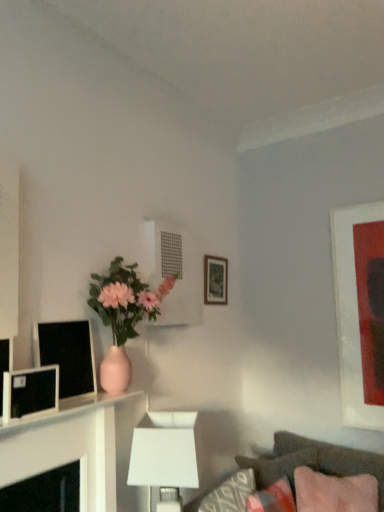
Question: Is the position of pink fabric pillow at lower right, the 2th pillow viewed from the front, less distant than that of velvet brown couch at lower right?

Choices:
 (A) no
 (B) yes

Answer: (A)

Question: From a real-world perspective, is pink fabric pillow at lower right, acting as the first pillow starting from the back, on velvet brown couch at lower right?

Choices:
 (A) yes
 (B) no

Answer: (A)

Question: Considering the relative sizes of pink fabric pillow at lower right, acting as the first pillow starting from the back, and velvet brown couch at lower right in the image provided, is pink fabric pillow at lower right, acting as the first pillow starting from the back, wider than velvet brown couch at lower right?

Choices:
 (A) no
 (B) yes

Answer: (A)

Question: Is there a large distance between pink fabric pillow at lower right, the 2th pillow viewed from the front, and velvet brown couch at lower right?

Choices:
 (A) no
 (B) yes

Answer: (A)

Question: Can you confirm if pink fabric pillow at lower right, acting as the first pillow starting from the back, is thinner than velvet brown couch at lower right?

Choices:
 (A) yes
 (B) no

Answer: (A)

Question: Is white matte table lamp at lower center in front of or behind velvet brown couch at lower right in the image?

Choices:
 (A) behind
 (B) front

Answer: (A)

Question: Is point (134, 451) closer or farther from the camera than point (271, 467)?

Choices:
 (A) farther
 (B) closer

Answer: (B)

Question: Is white matte table lamp at lower center situated inside velvet brown couch at lower right or outside?

Choices:
 (A) outside
 (B) inside

Answer: (A)

Question: From the image's perspective, is white matte table lamp at lower center located above or below velvet brown couch at lower right?

Choices:
 (A) below
 (B) above

Answer: (B)

Question: Based on their positions, is white matte table lamp at lower center located to the left or right of matte black monitor at left, the 1th computer monitor viewed from the front?

Choices:
 (A) right
 (B) left

Answer: (A)

Question: Is white matte table lamp at lower center bigger or smaller than matte black monitor at left, the second computer monitor viewed from the back?

Choices:
 (A) small
 (B) big

Answer: (B)

Question: Considering the positions of point (188, 446) and point (21, 373), is point (188, 446) closer or farther from the camera than point (21, 373)?

Choices:
 (A) farther
 (B) closer

Answer: (A)

Question: From a real-world perspective, relative to matte black monitor at left, the second computer monitor viewed from the back, is white matte table lamp at lower center vertically above or below?

Choices:
 (A) above
 (B) below

Answer: (B)

Question: Is point (72, 375) closer or farther from the camera than point (220, 276)?

Choices:
 (A) closer
 (B) farther

Answer: (A)

Question: From their relative heights in the image, would you say matte black monitor at left, the second computer monitor in the front-to-back sequence, is taller or shorter than matte wooden picture frame at center, placed as the 1th picture frame when sorted from back to front?

Choices:
 (A) short
 (B) tall

Answer: (B)